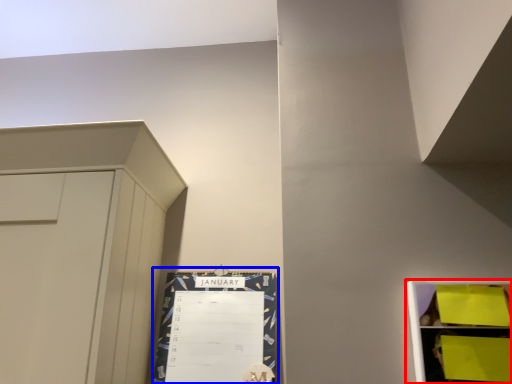
Question: Which object is further to the camera taking this photo, shelf (highlighted by a red box) or bulletin board (highlighted by a blue box)?

Choices:
 (A) shelf
 (B) bulletin board

Answer: (B)